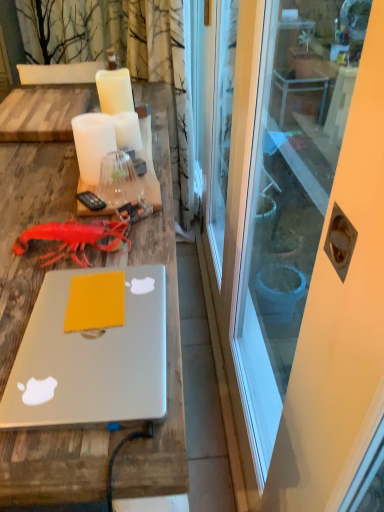
The image size is (384, 512). Find the location of `free location to the left of yellow matte notepad at center`. free location to the left of yellow matte notepad at center is located at coordinates (48, 298).